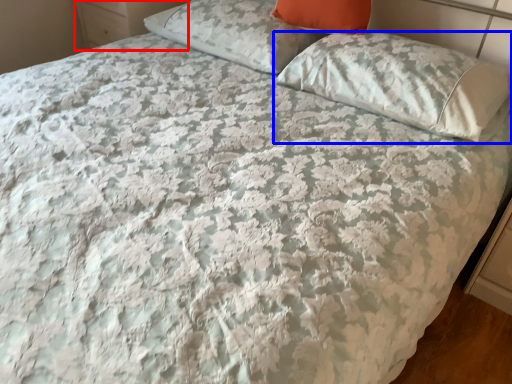
Question: Which object appears farthest to the camera in this image, dresser (highlighted by a red box) or pillow (highlighted by a blue box)?

Choices:
 (A) dresser
 (B) pillow

Answer: (A)